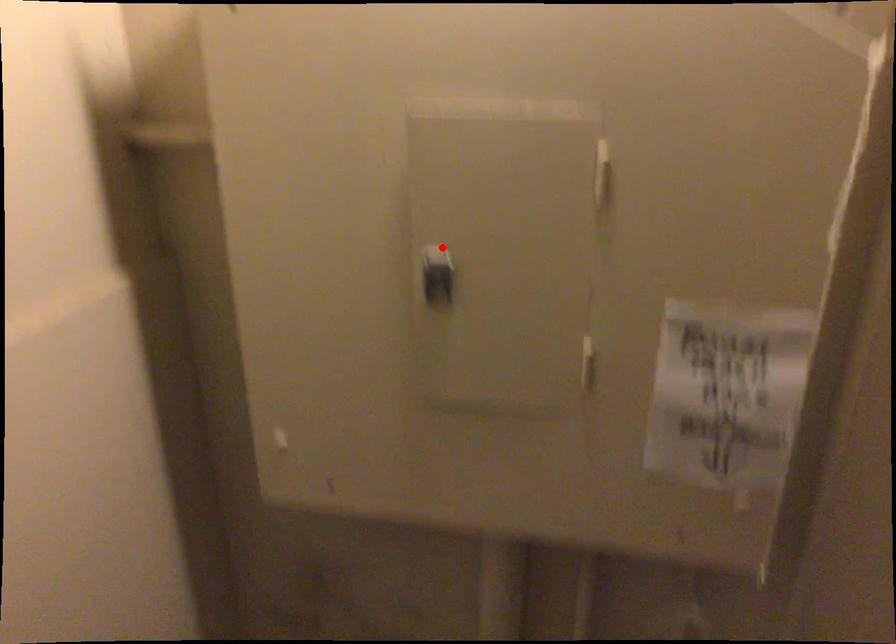
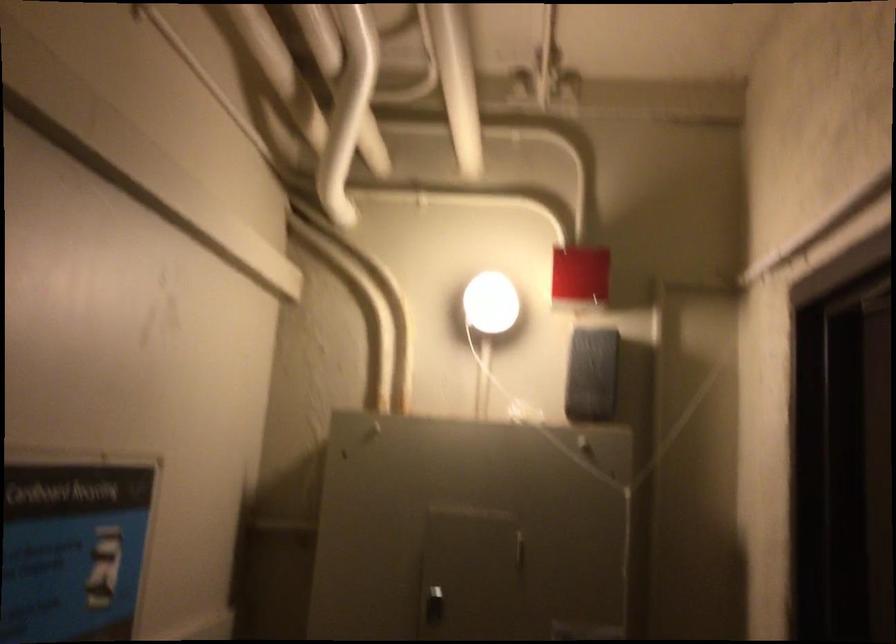
Question: A red point is marked in image1. In image2, is the corresponding 3D point closer to the camera or farther? Reply with the corresponding letter.

Choices:
 (A) The corresponding 3D point is closer.
 (B) The corresponding 3D point is farther.

Answer: (B)